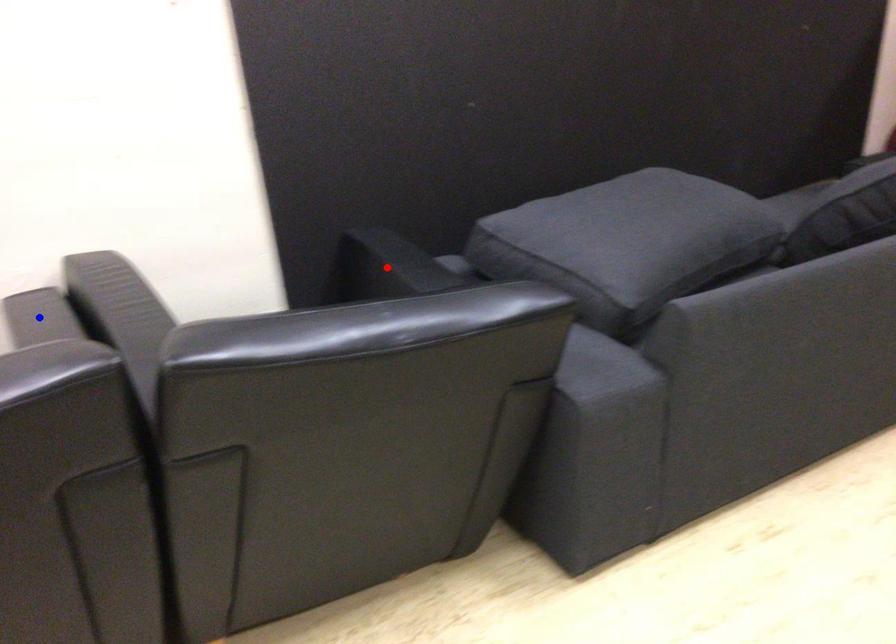
Question: In the image, two points are highlighted. Which point is nearer to the camera? Reply with the corresponding letter.

Choices:
 (A) blue point
 (B) red point

Answer: (A)